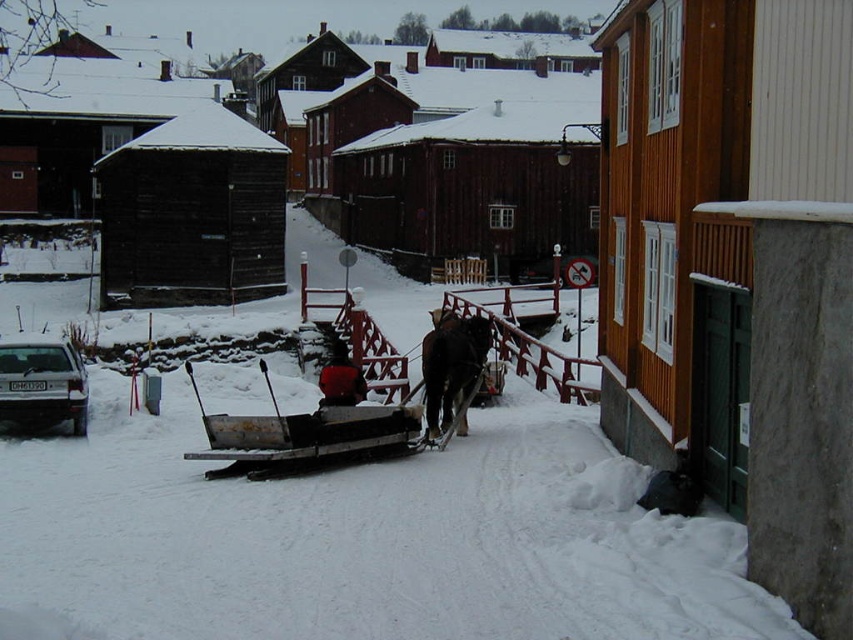
Question: Which object is farther from the camera taking this photo?

Choices:
 (A) dark brown glossy horse at center
 (B) metallic silver sled at center

Answer: (A)

Question: Is dark brown glossy horse at center above smooth red sled at center?

Choices:
 (A) no
 (B) yes

Answer: (A)

Question: Which point is closer to the camera?

Choices:
 (A) (410, 406)
 (B) (422, 353)

Answer: (A)

Question: Does metallic silver sled at center have a lesser width compared to smooth red sled at center?

Choices:
 (A) yes
 (B) no

Answer: (A)

Question: Is dark brown glossy horse at center positioned at the back of smooth red sled at center?

Choices:
 (A) no
 (B) yes

Answer: (B)

Question: Among these points, which one is nearest to the camera?

Choices:
 (A) (338, 365)
 (B) (271, 460)

Answer: (B)